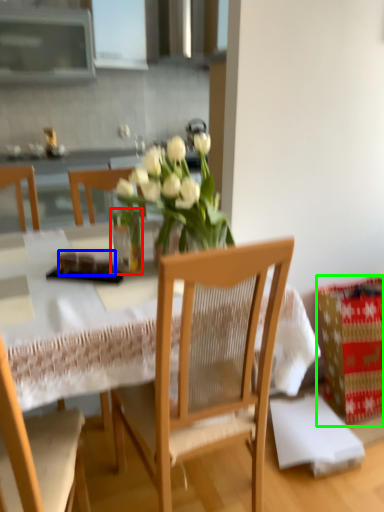
Question: Based on their relative distances, which object is nearer to glass vase (highlighted by a red box)? Choose from food (highlighted by a blue box) and cardboard box (highlighted by a green box).

Choices:
 (A) food
 (B) cardboard box

Answer: (A)